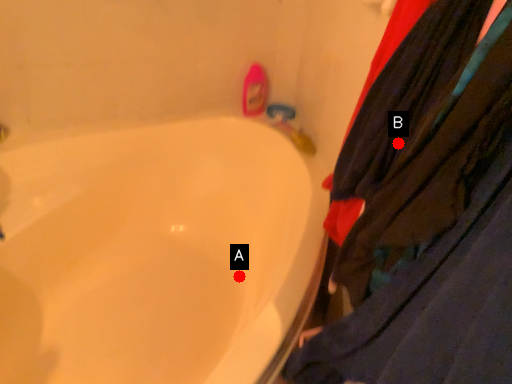
Question: Two points are circled on the image, labeled by A and B beside each circle. Which point is farther to the camera?

Choices:
 (A) A is further
 (B) B is further

Answer: (A)